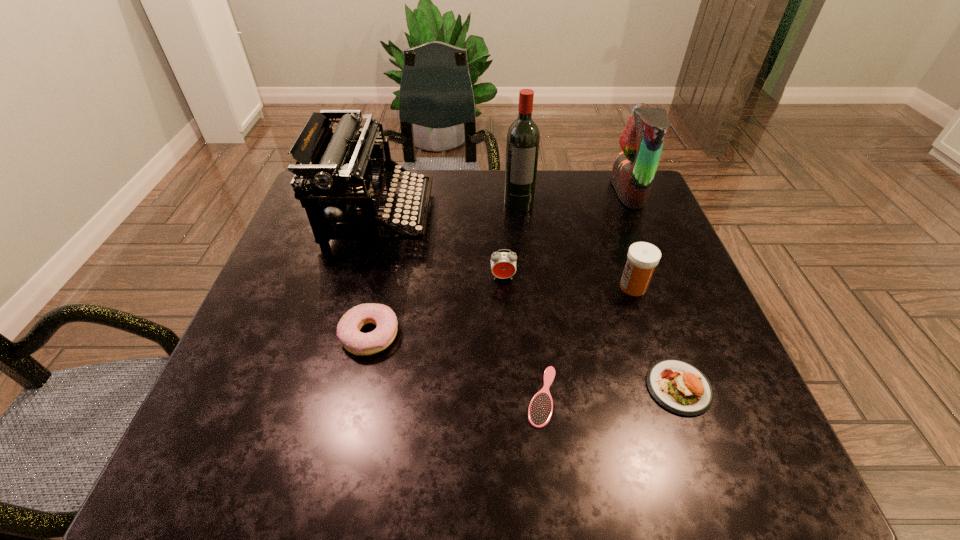
In the image, there is a desktop. Find the location of `vacant region at the left edge`. vacant region at the left edge is located at coordinates (277, 318).

Find the location of `free region at the right edge of the desktop`. free region at the right edge of the desktop is located at coordinates (692, 285).

At what (x,y) coordinates should I click in order to perform the action: click on free space at the near left corner of the desktop. Please return your answer as a coordinate pair (x, y). This screenshot has width=960, height=540. Looking at the image, I should click on (235, 470).

What are the coordinates of `vacant space at the far right corner of the desktop` in the screenshot? It's located at coord(594,194).

I want to click on unoccupied position between the parrot and the wine bottle, so click(x=573, y=197).

Locate an element on the screen. Image resolution: width=960 pixels, height=540 pixels. vacant point located between the parrot and the second shortest object is located at coordinates (654, 289).

Locate an element on the screen. free spot between the fourth shortest object and the parrot is located at coordinates (565, 235).

At what (x,y) coordinates should I click in order to perform the action: click on empty location between the tallest object and the medicine. Please return your answer as a coordinate pair (x, y). Looking at the image, I should click on (576, 245).

The image size is (960, 540). I want to click on free spot between the hairbrush and the typewriter, so click(460, 306).

The height and width of the screenshot is (540, 960). I want to click on vacant region between the second shortest object and the parrot, so pyautogui.click(x=654, y=289).